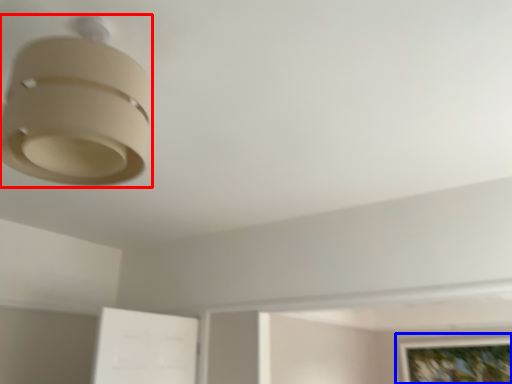
Question: Which object is closer to the camera taking this photo, lamp (highlighted by a red box) or picture frame (highlighted by a blue box)?

Choices:
 (A) lamp
 (B) picture frame

Answer: (A)